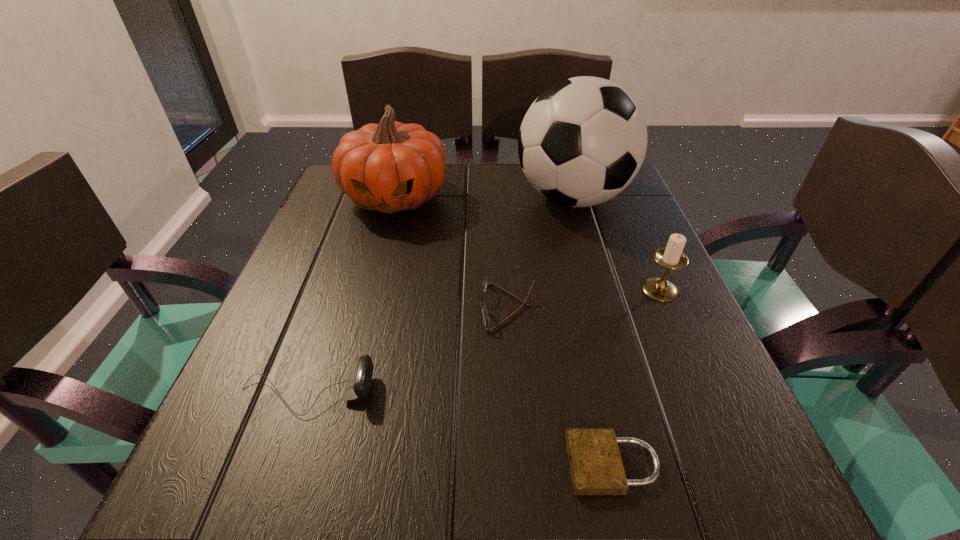
Find the location of a particular element. Image resolution: width=960 pixels, height=540 pixels. soccer ball is located at coordinates tap(583, 140).

Locate an element on the screen. the fifth shortest object is located at coordinates (389, 167).

Identify the location of candle holder. (671, 257).

The height and width of the screenshot is (540, 960). I want to click on the fifth farthest object, so click(x=359, y=380).

Locate an element on the screen. webcam is located at coordinates (359, 380).

Where is `spectacles`? The width and height of the screenshot is (960, 540). spectacles is located at coordinates (485, 316).

Locate an element on the screen. This screenshot has width=960, height=540. padlock is located at coordinates (596, 467).

Image resolution: width=960 pixels, height=540 pixels. In order to click on the shortest object in this screenshot , I will do `click(596, 467)`.

The image size is (960, 540). I want to click on vacant area situated on the front of the tallest object, so click(613, 341).

Locate an element on the screen. vacant space situated on the face of the fifth shortest object is located at coordinates (371, 291).